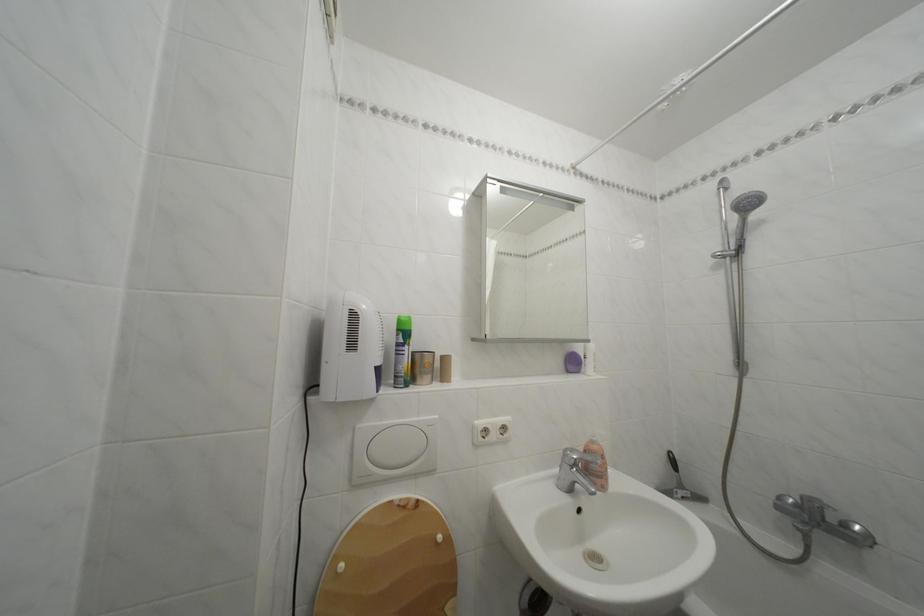
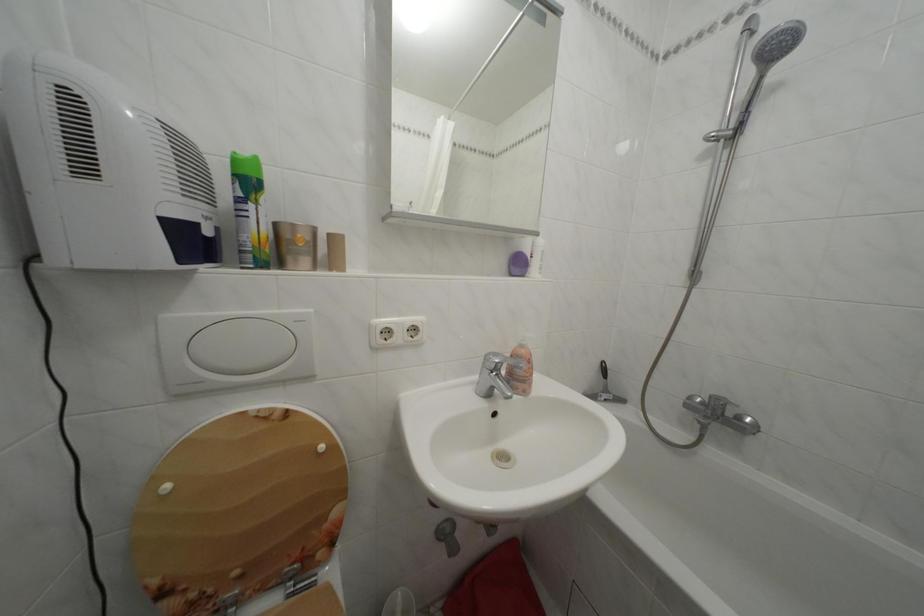
Locate, in the second image, the point that corresponds to (602,448) in the first image.

(530, 352)